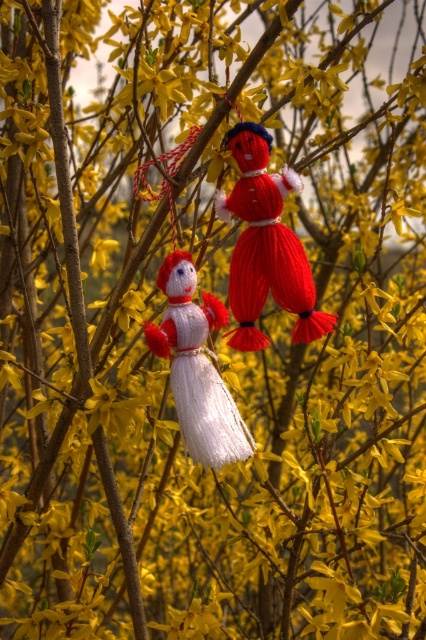
How distant is knitted red doll at center from knitted white doll at center?

They are 2.78 inches apart.

Between knitted red doll at center and knitted white doll at center, which one has more height?

With more height is knitted red doll at center.

Which is behind, point (278, 218) or point (215, 436)?

The point (215, 436) is more distant.

Locate an element on the screen. Image resolution: width=426 pixels, height=640 pixels. knitted red doll at center is located at coordinates (265, 244).